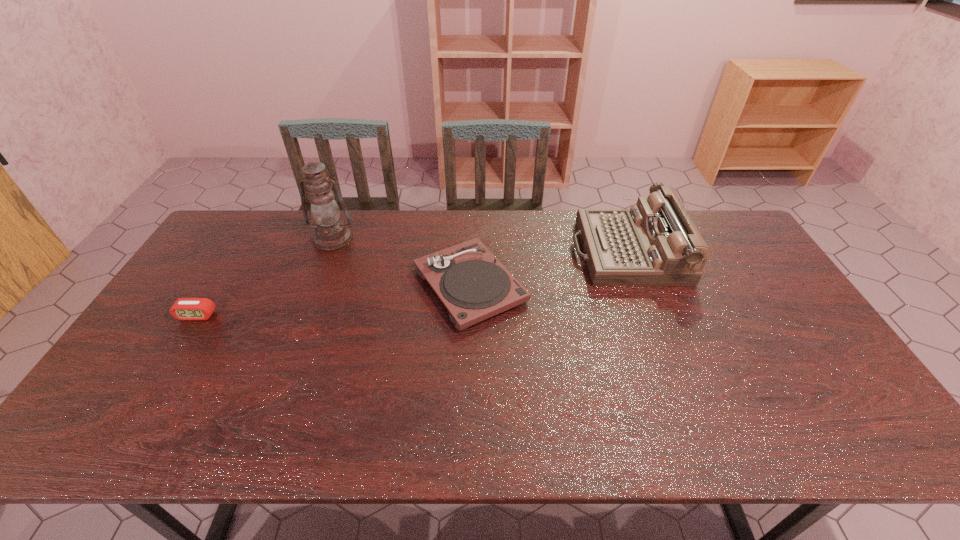
Where is `the tallest object`? The height and width of the screenshot is (540, 960). the tallest object is located at coordinates (331, 233).

Identify the location of the second object from left to right. (331, 233).

Locate an element on the screen. This screenshot has width=960, height=540. the second tallest object is located at coordinates (654, 243).

You are a GUI agent. You are given a task and a screenshot of the screen. Output one action in this format:
    pyautogui.click(x=<x>, y=<y>)
    Task: Click on the typewriter
    The width and height of the screenshot is (960, 540).
    Given the screenshot: What is the action you would take?
    pyautogui.click(x=654, y=243)

Locate an element on the screen. the second object from right to left is located at coordinates (471, 282).

You are a GUI agent. You are given a task and a screenshot of the screen. Output one action in this format:
    pyautogui.click(x=<x>, y=<y>)
    Task: Click on the third tallest object
    The image size is (960, 540).
    Given the screenshot: What is the action you would take?
    pyautogui.click(x=471, y=282)

Find the location of a particular element. the leftmost object is located at coordinates (183, 308).

The width and height of the screenshot is (960, 540). I want to click on alarm clock, so click(183, 308).

Where is `vacant region located 0.200m on the left of the tallest object`? Image resolution: width=960 pixels, height=540 pixels. vacant region located 0.200m on the left of the tallest object is located at coordinates (252, 239).

You are a GUI agent. You are given a task and a screenshot of the screen. Output one action in this format:
    pyautogui.click(x=<x>, y=<y>)
    Task: Click on the vacant position located on the keyboard of the third shortest object
    
    Given the screenshot: What is the action you would take?
    pyautogui.click(x=480, y=251)